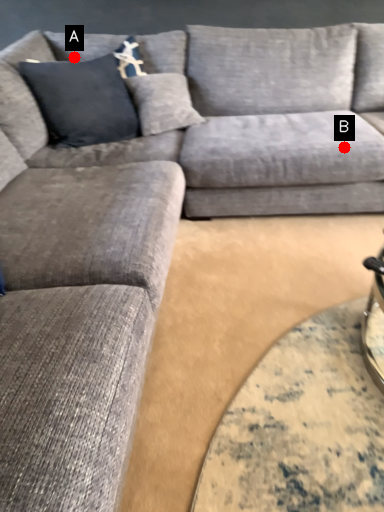
Question: Two points are circled on the image, labeled by A and B beside each circle. Among these points, which one is nearest to the camera?

Choices:
 (A) A is closer
 (B) B is closer

Answer: (B)